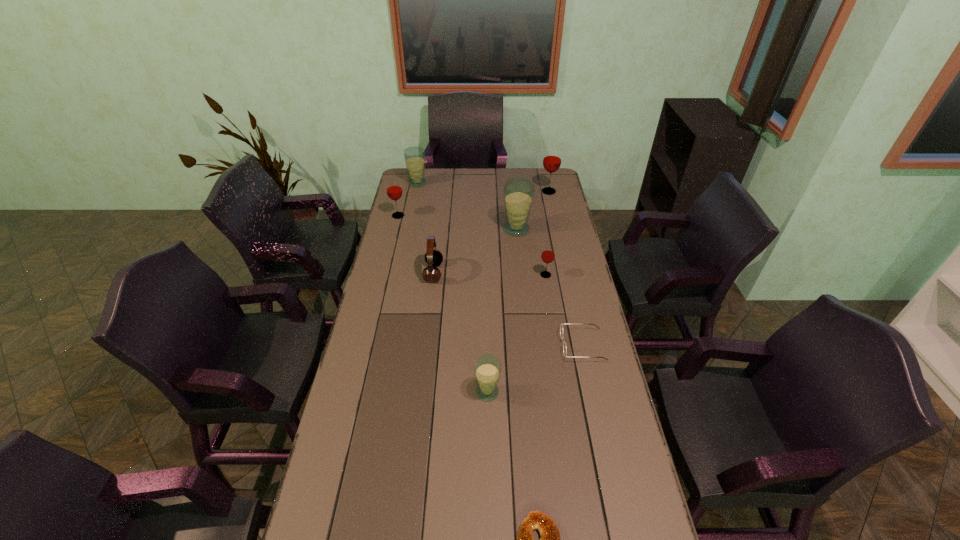
Locate an element on the screen. The height and width of the screenshot is (540, 960). blank space located 0.270m on the ear pads of the headset is located at coordinates (511, 273).

At what (x,y) coordinates should I click in order to perform the action: click on free location located on the right of the second nearest glass. Please return your answer as a coordinate pair (x, y). Looking at the image, I should click on (575, 275).

The height and width of the screenshot is (540, 960). In order to click on blank space located on the front of the nearest blue glass in this screenshot , I will do `click(489, 523)`.

The width and height of the screenshot is (960, 540). Identify the location of vacant space located 0.060m on the front-facing side of the spectacles. (543, 346).

The image size is (960, 540). What are the coordinates of `free space located on the front-facing side of the spectacles` in the screenshot? It's located at (481, 346).

This screenshot has width=960, height=540. I want to click on free space located 0.100m on the front-facing side of the spectacles, so click(x=531, y=346).

What are the coordinates of `spectacles that is at the right edge` in the screenshot? It's located at (561, 326).

At what (x,y) coordinates should I click in order to perform the action: click on object that is at the far left corner. Please return your answer as a coordinate pair (x, y). Looking at the image, I should click on (414, 156).

Locate an element on the screen. object at the far right corner is located at coordinates (552, 158).

In the image, there is a desktop. Where is `free region at the left edge`? The height and width of the screenshot is (540, 960). free region at the left edge is located at coordinates (346, 414).